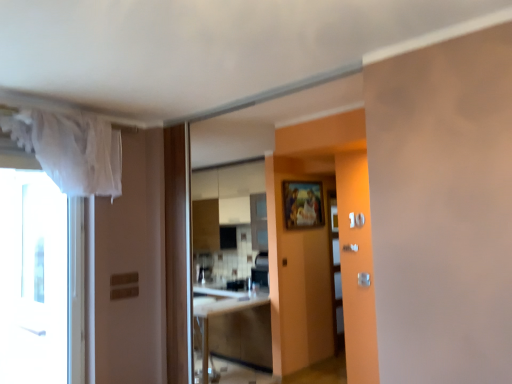
What do you see at coordinates (33, 279) in the screenshot? I see `white glass window at left` at bounding box center [33, 279].

In order to click on silver metallic door handle at center-right, the 2th door handle when ordered from right to left in this screenshot , I will do `click(350, 248)`.

Describe the element at coordinates (232, 327) in the screenshot. I see `wooden cabinet at center` at that location.

Describe the element at coordinates (71, 150) in the screenshot. I see `white sheer curtain at upper left` at that location.

Where is `white sheer curtain at upper left`? white sheer curtain at upper left is located at coordinates (71, 150).

Locate an element on the screen. white glass window at left is located at coordinates (33, 279).

Between silver metallic door handle at center-right, placed as the second door handle when sorted from front to back, and white sheer curtain at upper left, which one has more height?

With more height is white sheer curtain at upper left.

From the picture: Between silver metallic door handle at center-right, which ranks as the 1th door handle in back-to-front order, and white sheer curtain at upper left, which one appears on the left side from the viewer's perspective?

Positioned to the left is white sheer curtain at upper left.

Where is `door handle that is the 1st object located below the white sheer curtain at upper left (from the image's perspective)`? door handle that is the 1st object located below the white sheer curtain at upper left (from the image's perspective) is located at coordinates (350, 248).

In terms of size, does silver metallic door handle at center-right, placed as the second door handle when sorted from front to back, appear bigger or smaller than white sheer curtain at upper left?

Considering their sizes, silver metallic door handle at center-right, placed as the second door handle when sorted from front to back, takes up less space than white sheer curtain at upper left.

Is wooden painted frame at center a part of white glass window at left?

No.

Consider the image. Considering the relative positions of white glass window at left and wooden painted frame at center in the image provided, is white glass window at left to the left of wooden painted frame at center from the viewer's perspective?

Yes.

How many degrees apart are the facing directions of white glass window at left and wooden painted frame at center?

They differ by 1.16 degrees in their facing directions.

Which of these two, white glass window at left or wooden painted frame at center, is thinner?

Thinner between the two is wooden painted frame at center.

Is white glass window at left wider or thinner than silver metallic door handle at center-right, which ranks as the 1th door handle in left-to-right order?

Clearly, white glass window at left has more width compared to silver metallic door handle at center-right, which ranks as the 1th door handle in left-to-right order.

Image resolution: width=512 pixels, height=384 pixels. I want to click on door handle above the white glass window at left (from the image's perspective), so click(350, 248).

Does white glass window at left have a larger size compared to silver metallic door handle at center-right, which ranks as the 1th door handle in back-to-front order?

Correct, white glass window at left is larger in size than silver metallic door handle at center-right, which ranks as the 1th door handle in back-to-front order.

Is white glass window at left spatially inside silver metallic door handle at center-right, the 2th door handle when ordered from right to left, or outside of it?

white glass window at left is not enclosed by silver metallic door handle at center-right, the 2th door handle when ordered from right to left.

Would you say white glass window at left is outside satin silver door handle at center right, placed as the second door handle when sorted from left to right?

white glass window at left lies outside satin silver door handle at center right, placed as the second door handle when sorted from left to right,'s area.

Is white glass window at left to the left of satin silver door handle at center right, marked as the 1th door handle in a front-to-back arrangement, from the viewer's perspective?

Result: Yes, white glass window at left is to the left of satin silver door handle at center right, marked as the 1th door handle in a front-to-back arrangement.

Are white glass window at left and satin silver door handle at center right, which ranks as the second door handle in top-to-bottom order, far apart?

Yes, white glass window at left and satin silver door handle at center right, which ranks as the second door handle in top-to-bottom order, are located far from each other.

Which object is positioned more to the right, wooden cabinet at center or satin silver door handle at center right, which is counted as the 2th door handle, starting from the back?

From the viewer's perspective, satin silver door handle at center right, which is counted as the 2th door handle, starting from the back, appears more on the right side.

How distant is wooden cabinet at center from satin silver door handle at center right, marked as the 1th door handle in a front-to-back arrangement?

wooden cabinet at center is 2.50 meters away from satin silver door handle at center right, marked as the 1th door handle in a front-to-back arrangement.

Is wooden cabinet at center facing towards satin silver door handle at center right, which ranks as the second door handle in top-to-bottom order?

Yes, wooden cabinet at center is turned towards satin silver door handle at center right, which ranks as the second door handle in top-to-bottom order.

There is a wooden cabinet at center. Where is `the 1st door handle above it (from a real-world perspective)`? This screenshot has width=512, height=384. the 1st door handle above it (from a real-world perspective) is located at coordinates 364,279.

Between wooden painted frame at center and white sheer curtain at upper left, which one has less height?

wooden painted frame at center.

Does wooden painted frame at center lie in front of white sheer curtain at upper left?

That is False.

From a real-world perspective, is wooden painted frame at center below white sheer curtain at upper left?

Correct, in the physical world, wooden painted frame at center is lower than white sheer curtain at upper left.

Does wooden painted frame at center turn towards white sheer curtain at upper left?

No, wooden painted frame at center does not turn towards white sheer curtain at upper left.

From the picture: From a real-world perspective, which is physically above, white glass window at left or white sheer curtain at upper left?

From a 3D spatial view, white sheer curtain at upper left is above.

In order to click on curtain on the right of the white glass window at left in this screenshot , I will do `click(71, 150)`.

Would you consider white glass window at left to be distant from white sheer curtain at upper left?

That's not correct — white glass window at left is a little close to white sheer curtain at upper left.

The width and height of the screenshot is (512, 384). I want to click on curtain in front of the silver metallic door handle at center-right, placed as the second door handle when sorted from front to back, so click(71, 150).

The image size is (512, 384). In order to click on picture frame behind the white glass window at left in this screenshot , I will do `click(302, 204)`.

Which object lies further to the anchor point white glass window at left, silver metallic door handle at center-right, placed as the second door handle when sorted from front to back, or satin silver door handle at center right, which ranks as the 1th door handle in right-to-left order?

satin silver door handle at center right, which ranks as the 1th door handle in right-to-left order, is positioned further to the anchor white glass window at left.

When comparing their distances from wooden painted frame at center, does white sheer curtain at upper left or silver metallic door handle at center-right, which ranks as the 1th door handle in left-to-right order, seem closer?

silver metallic door handle at center-right, which ranks as the 1th door handle in left-to-right order, is positioned closer to the anchor wooden painted frame at center.

When comparing their distances from satin silver door handle at center right, which ranks as the second door handle in top-to-bottom order, does silver metallic door handle at center-right, which is the second door handle in bottom-to-top order, or white sheer curtain at upper left seem closer?

silver metallic door handle at center-right, which is the second door handle in bottom-to-top order, is positioned closer to the anchor satin silver door handle at center right, which ranks as the second door handle in top-to-bottom order.

Estimate the real-world distances between objects in this image. Which object is closer to wooden painted frame at center, white glass window at left or wooden cabinet at center?

wooden cabinet at center lies closer to wooden painted frame at center than the other object.

Which object lies nearer to the anchor point wooden painted frame at center, white glass window at left or silver metallic door handle at center-right, positioned as the 1th door handle in top-to-bottom order?

Based on the image, silver metallic door handle at center-right, positioned as the 1th door handle in top-to-bottom order, appears to be nearer to wooden painted frame at center.

From the image, which object appears to be nearer to white glass window at left, wooden painted frame at center or silver metallic door handle at center-right, positioned as the 1th door handle in top-to-bottom order?

Among the two, silver metallic door handle at center-right, positioned as the 1th door handle in top-to-bottom order, is located nearer to white glass window at left.

Based on their spatial positions, is white glass window at left or wooden cabinet at center further from satin silver door handle at center right, which ranks as the 1th door handle in right-to-left order?

A: white glass window at left is further to satin silver door handle at center right, which ranks as the 1th door handle in right-to-left order.

Looking at the image, which one is located closer to white sheer curtain at upper left, silver metallic door handle at center-right, placed as the second door handle when sorted from front to back, or wooden painted frame at center?

The object closer to white sheer curtain at upper left is silver metallic door handle at center-right, placed as the second door handle when sorted from front to back.

This screenshot has width=512, height=384. What are the coordinates of `cabinetry located between white glass window at left and satin silver door handle at center right, which is counted as the 2th door handle, starting from the back, in the left-right direction` in the screenshot? It's located at (232, 327).

Identify the location of cabinetry between white sheer curtain at upper left and silver metallic door handle at center-right, which ranks as the 1th door handle in back-to-front order. (x=232, y=327).

Locate an element on the screen. door handle between satin silver door handle at center right, placed as the second door handle when sorted from left to right, and wooden painted frame at center from front to back is located at coordinates (350, 248).

The height and width of the screenshot is (384, 512). In order to click on cabinetry between white sheer curtain at upper left and satin silver door handle at center right, which ranks as the second door handle in top-to-bottom order in this screenshot , I will do `click(232, 327)`.